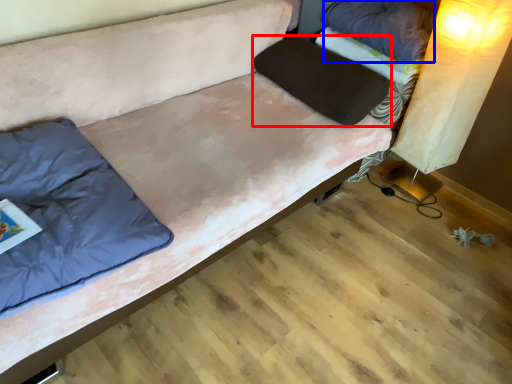
Question: Which point is further to the camera, pillow (highlighted by a red box) or pillow (highlighted by a blue box)?

Choices:
 (A) pillow
 (B) pillow

Answer: (B)